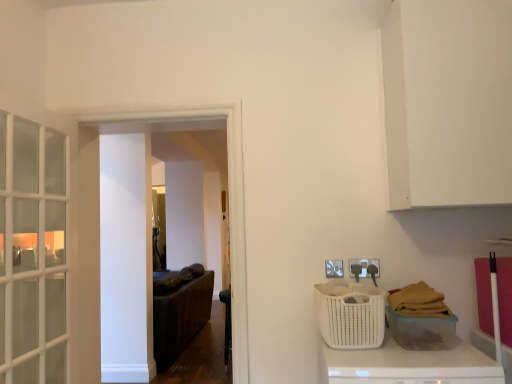
Question: From a real-world perspective, is white matte counter top at lower right below white wicker basket at lower right, which is the first basket in right-to-left order?

Choices:
 (A) no
 (B) yes

Answer: (B)

Question: Does white matte counter top at lower right lie in front of white wicker basket at lower right, the second basket when ordered from left to right?

Choices:
 (A) yes
 (B) no

Answer: (A)

Question: Could white wicker basket at lower right, the second basket when ordered from left to right, be considered to be inside white matte counter top at lower right?

Choices:
 (A) yes
 (B) no

Answer: (B)

Question: Is white matte counter top at lower right shorter than white wicker basket at lower right, which is the first basket in right-to-left order?

Choices:
 (A) no
 (B) yes

Answer: (A)

Question: Does white matte counter top at lower right have a larger size compared to white wicker basket at lower right, which is the first basket in right-to-left order?

Choices:
 (A) yes
 (B) no

Answer: (A)

Question: From a real-world perspective, is white wicker basket at lower right, the second basket when ordered from left to right, positioned above or below white woven basket at lower right, which is the first basket in left-to-right order?

Choices:
 (A) below
 (B) above

Answer: (A)

Question: Is white wicker basket at lower right, which is the first basket in right-to-left order, situated inside white woven basket at lower right, which is the first basket in left-to-right order, or outside?

Choices:
 (A) inside
 (B) outside

Answer: (B)

Question: Considering the positions of white wicker basket at lower right, which is the first basket in right-to-left order, and white woven basket at lower right, which is the first basket in left-to-right order, in the image, is white wicker basket at lower right, which is the first basket in right-to-left order, wider or thinner than white woven basket at lower right, which is the first basket in left-to-right order,?

Choices:
 (A) wide
 (B) thin

Answer: (B)

Question: Looking at the image, does white wicker basket at lower right, the second basket when ordered from left to right, seem bigger or smaller compared to white woven basket at lower right, the 2th basket viewed from the right?

Choices:
 (A) big
 (B) small

Answer: (B)

Question: From the image's perspective, is white woven basket at lower right, the 2th basket viewed from the right, positioned above or below black leather chair at center?

Choices:
 (A) above
 (B) below

Answer: (A)

Question: Based on their sizes in the image, would you say white woven basket at lower right, which is the first basket in left-to-right order, is bigger or smaller than black leather chair at center?

Choices:
 (A) small
 (B) big

Answer: (A)

Question: Is white woven basket at lower right, the 2th basket viewed from the right, wider or thinner than black leather chair at center?

Choices:
 (A) thin
 (B) wide

Answer: (B)

Question: Is white woven basket at lower right, which is the first basket in left-to-right order, inside the boundaries of black leather chair at center, or outside?

Choices:
 (A) inside
 (B) outside

Answer: (B)

Question: Is black leather chair at center to the left or to the right of white matte counter top at lower right in the image?

Choices:
 (A) left
 (B) right

Answer: (A)

Question: In the image, is black leather chair at center positioned in front of or behind white matte counter top at lower right?

Choices:
 (A) behind
 (B) front

Answer: (A)